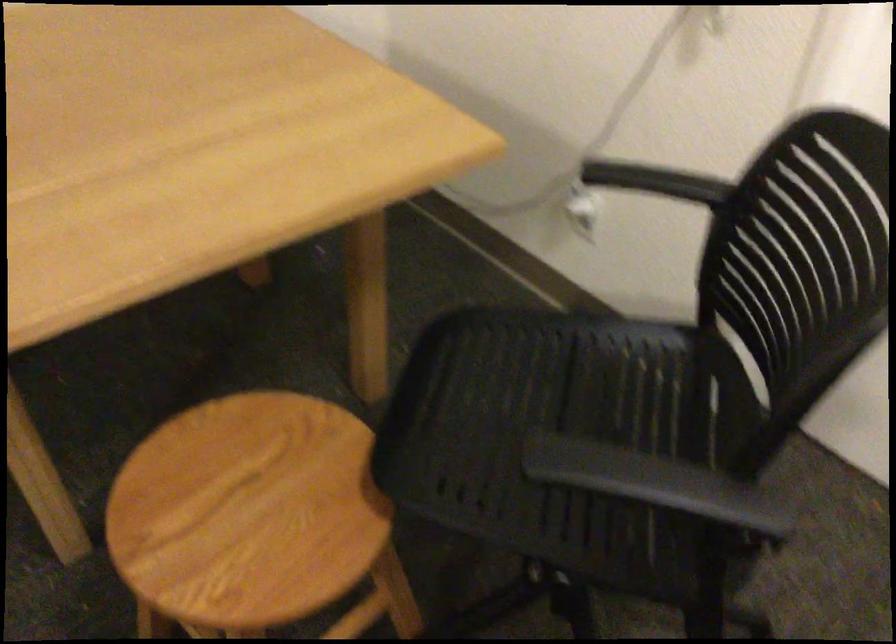
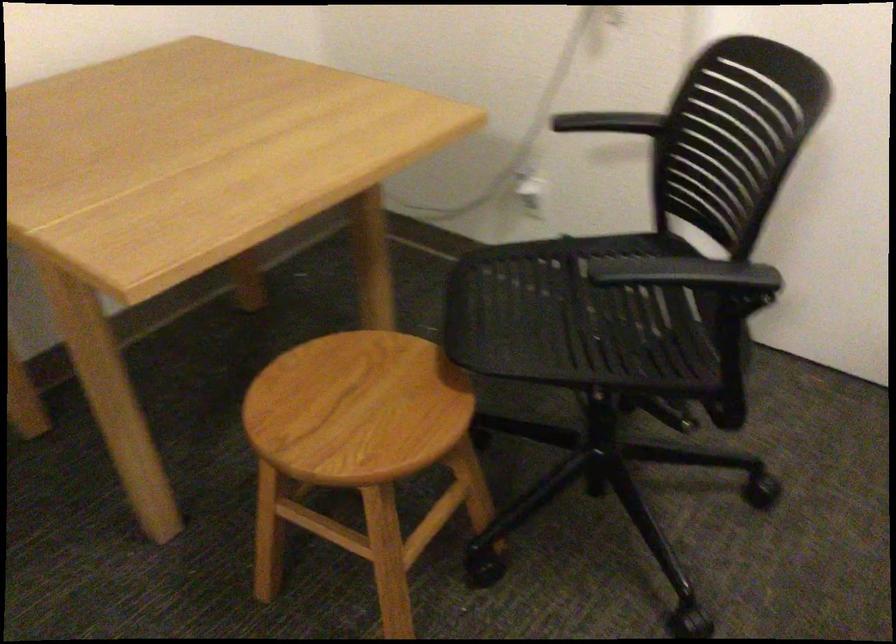
In the second image, find the point that corresponds to point (665, 480) in the first image.

(685, 272)